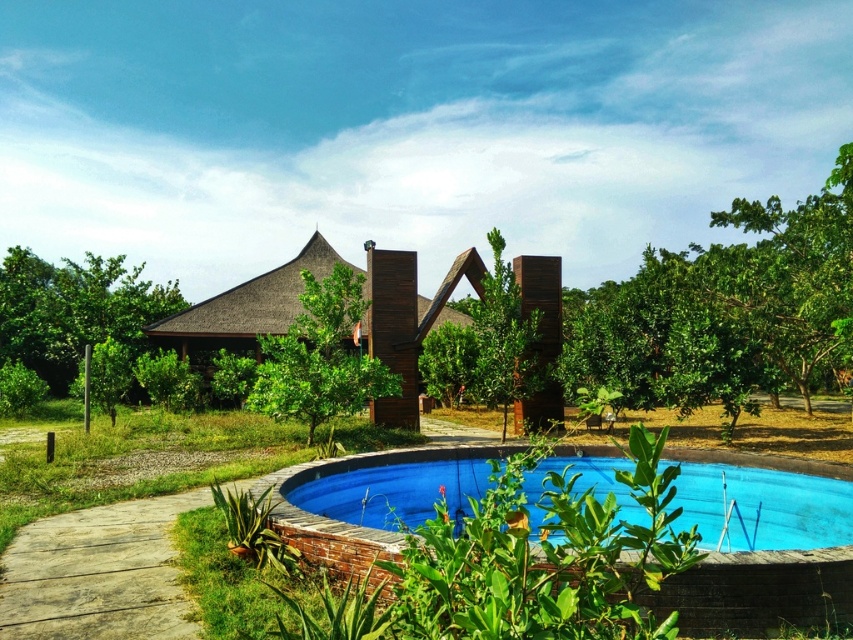
Who is taller, green leafy tree at upper right or green matte tree at center?

green leafy tree at upper right

Which is more to the left, green leafy tree at upper right or green matte tree at center?

From the viewer's perspective, green matte tree at center appears more on the left side.

Is point (612, 326) closer to viewer compared to point (556, 419)?

Yes, point (612, 326) is closer to viewer.

In order to click on green leafy tree at upper right in this screenshot , I will do `click(726, 308)`.

Is point (734, 259) farther from viewer compared to point (71, 342)?

No.

This screenshot has height=640, width=853. I want to click on green leafy tree at upper right, so click(726, 308).

Does green matte tree at center have a lesser width compared to green leafy tree at center?

Correct, green matte tree at center's width is less than green leafy tree at center's.

Image resolution: width=853 pixels, height=640 pixels. I want to click on green matte tree at center, so click(x=506, y=340).

Is point (486, 278) behind point (352, 324)?

That is False.

Where is `green matte tree at center`? This screenshot has height=640, width=853. green matte tree at center is located at coordinates (506, 340).